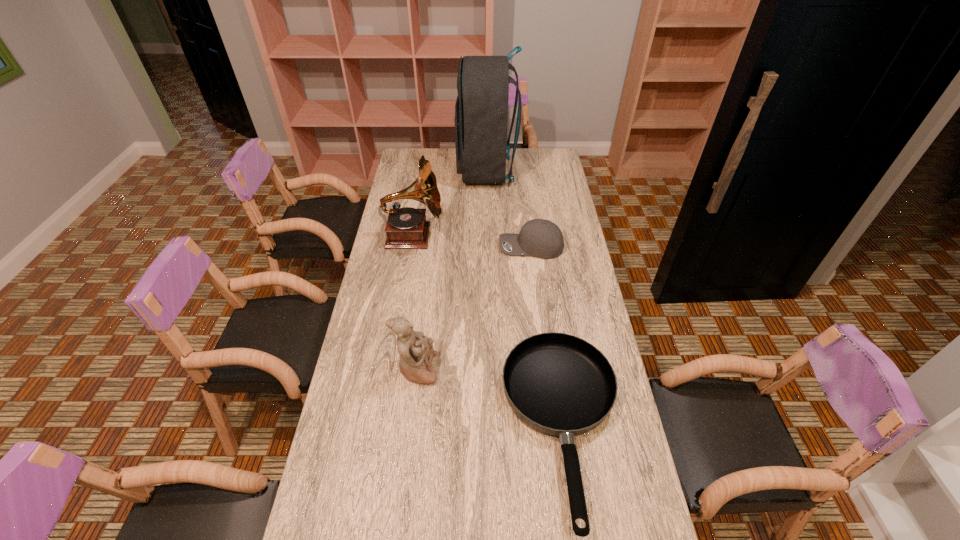
Locate an element on the screen. The width and height of the screenshot is (960, 540). vacant space located on the front brim of the baseball cap is located at coordinates (468, 247).

Image resolution: width=960 pixels, height=540 pixels. I want to click on vacant region located 0.310m on the front brim of the baseball cap, so click(423, 247).

At what (x,y) coordinates should I click in order to perform the action: click on vacant space located 0.130m on the front brim of the baseball cap. Please return your answer as a coordinate pair (x, y). This screenshot has height=540, width=960. Looking at the image, I should click on (468, 247).

Identify the location of object that is at the far edge. [481, 111].

At what (x,y) coordinates should I click in order to perform the action: click on phonograph_record that is positioned at the left edge. Please return your answer as a coordinate pair (x, y). Looking at the image, I should click on (406, 227).

The width and height of the screenshot is (960, 540). Find the location of `figurine positioned at the left edge`. figurine positioned at the left edge is located at coordinates (416, 352).

Find the location of a particular element. This screenshot has width=960, height=540. object located at the right edge is located at coordinates (540, 238).

Locate an element on the screen. The width and height of the screenshot is (960, 540). vacant area at the far edge of the desktop is located at coordinates (434, 165).

Find the location of a particular element. vacant space at the left edge of the desktop is located at coordinates (412, 251).

This screenshot has height=540, width=960. What are the coordinates of `free space at the right edge of the desktop` in the screenshot? It's located at (568, 216).